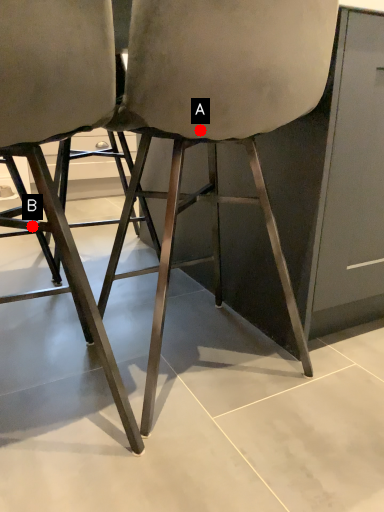
Question: Two points are circled on the image, labeled by A and B beside each circle. Among these points, which one is nearest to the camera?

Choices:
 (A) A is closer
 (B) B is closer

Answer: (A)